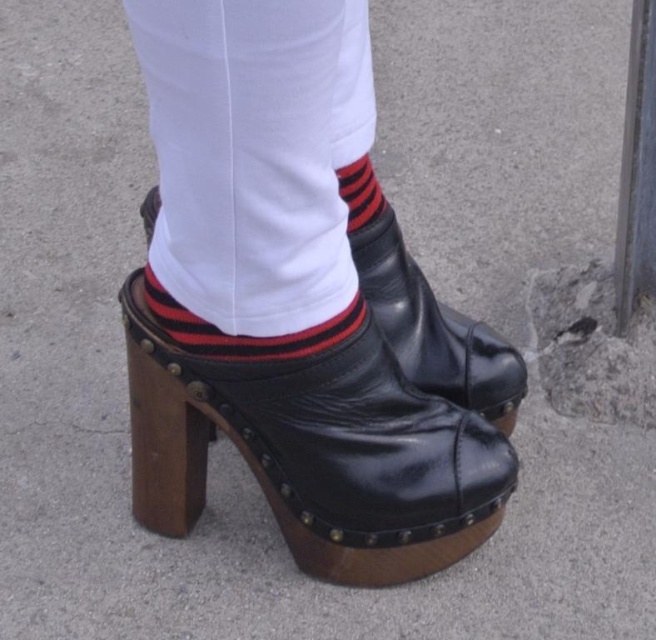
Question: In this image, where is black leather socks at lower center located relative to black striped sock at center?

Choices:
 (A) left
 (B) right

Answer: (A)

Question: Which of the following is the closest to the observer?

Choices:
 (A) shiny black boot at center
 (B) striped cotton sock at center

Answer: (B)

Question: Which object appears closest to the camera in this image?

Choices:
 (A) black leather socks at lower center
 (B) black striped sock at center
 (C) shiny black boot at center
 (D) black leather clog at center

Answer: (A)

Question: Does black leather clog at center come in front of striped cotton sock at center?

Choices:
 (A) yes
 (B) no

Answer: (B)

Question: Estimate the real-world distances between objects in this image. Which object is closer to the black leather clog at center?

Choices:
 (A) black striped sock at center
 (B) black leather socks at lower center

Answer: (B)

Question: Is black leather clog at center positioned in front of shiny black boot at center?

Choices:
 (A) yes
 (B) no

Answer: (A)